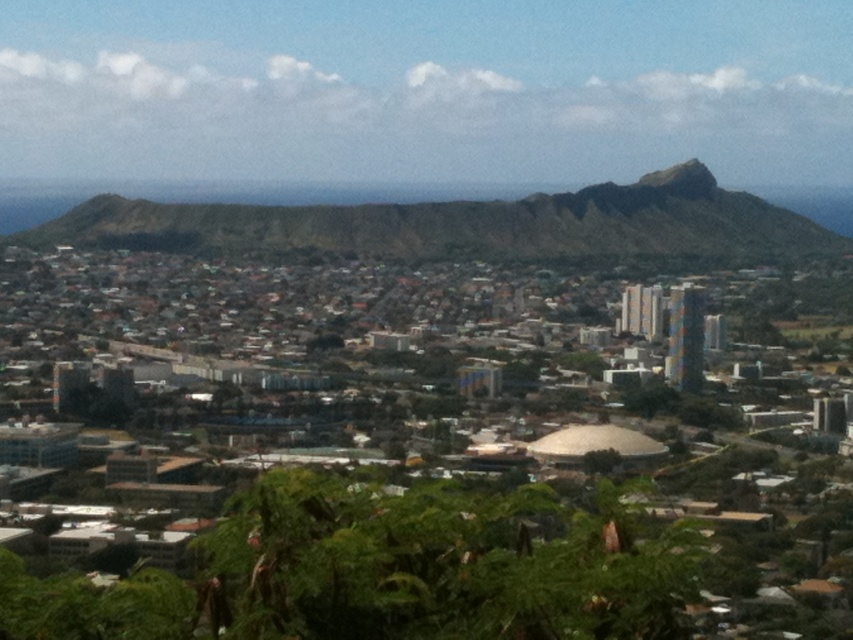
You are a hiker who wants to reach the green mossy rock at upper center from the brown rocky mountain at center. Given that your average walking pace is 1.5 meters per second, how long will it take you to walk directly between the two landmarks?

The distance between the brown rocky mountain at center and the green mossy rock at upper center is 36.05 meters. At a walking pace of 1.5 meters per second, it would take approximately 24 seconds to walk directly between them.